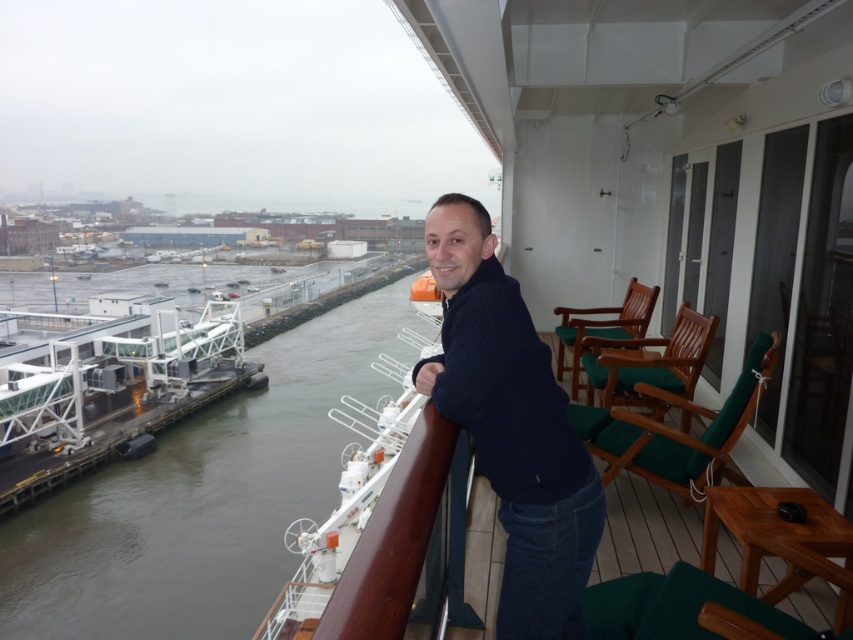
You are standing on the cruise ship deck and want to take a photo of the waterfront view. You notice a person wearing a dark blue ribbed sweater at center. Where should you position yourself to ensure the sweater is in the frame?

To ensure the dark blue ribbed sweater at center is in the frame, position yourself near the center of the deck since the sweater is located at point (x=511, y=426), which is centrally positioned on the deck.

You are standing on the cruise ship deck and want to take a photo of both the point at coordinates (293, 557) and the point at coordinates (642, 419). Which point should you focus on first to ensure both are in focus?

You should focus on the point at coordinates (293, 557) first because it is closer to the camera than the point at coordinates (642, 419). This way, both points will be in focus as the closer point sets the focal plane.

You are standing on the cruise ship deck and want to walk from the wooden railing to the far edge of the deck. Which point should you head towards, point (451, 241) or point (469, 531)?

You should head towards point (469, 531) because it is farther from the viewer than point (451, 241), which is closer to the railing.